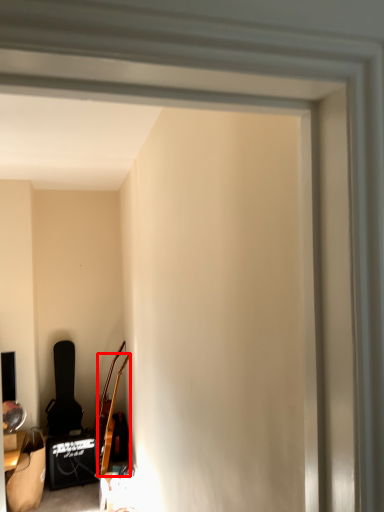
Question: Considering the relative positions of guitar (annotated by the red box) and chair in the image provided, where is guitar (annotated by the red box) located with respect to the staircase?

Choices:
 (A) right
 (B) left

Answer: (A)